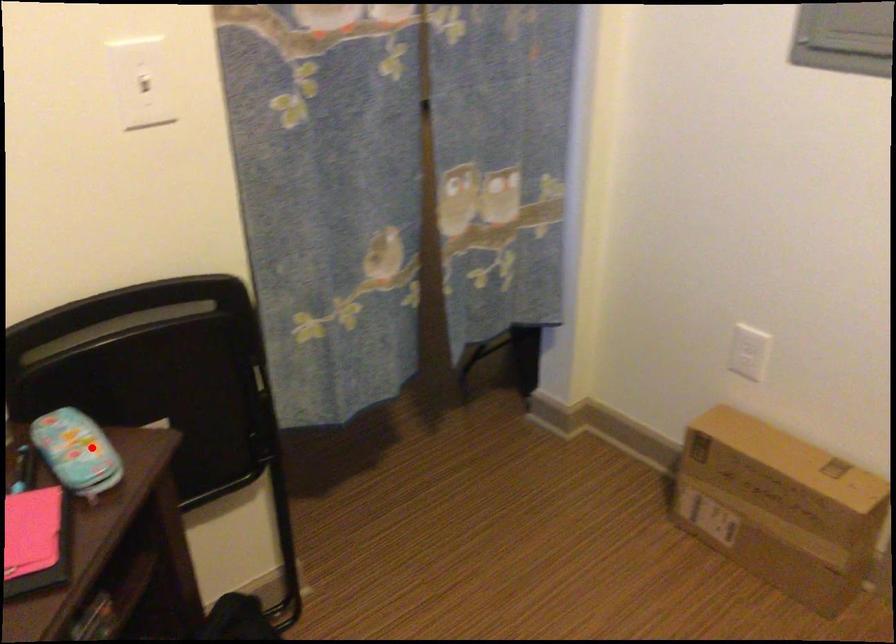
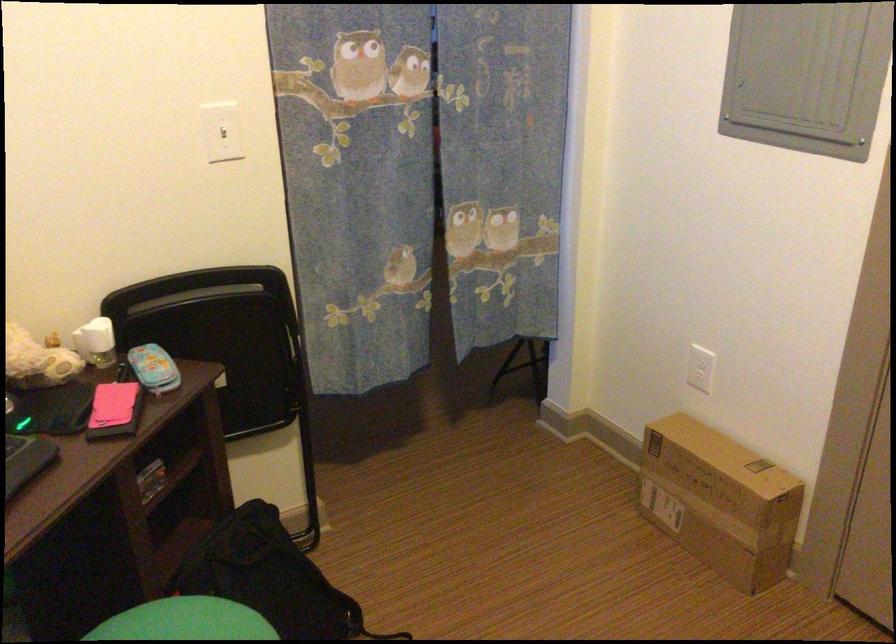
Question: I am providing you with two images of the same scene from different viewpoints. Image1 has a red point marked. In image2, the corresponding 3D location appears at what relative position? Reply with the corresponding letter.

Choices:
 (A) Closer
 (B) Farther

Answer: (B)